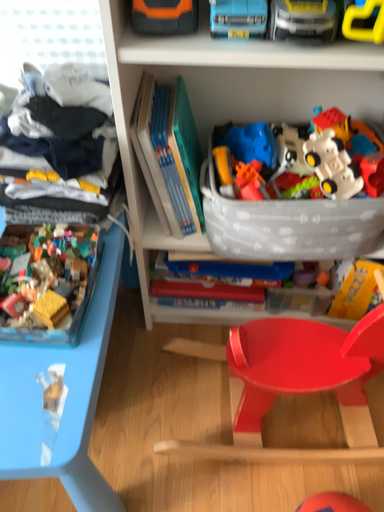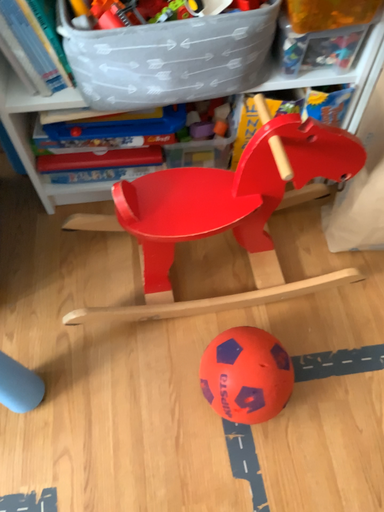
Question: Which way did the camera rotate in the video?

Choices:
 (A) rotated right
 (B) rotated left

Answer: (A)